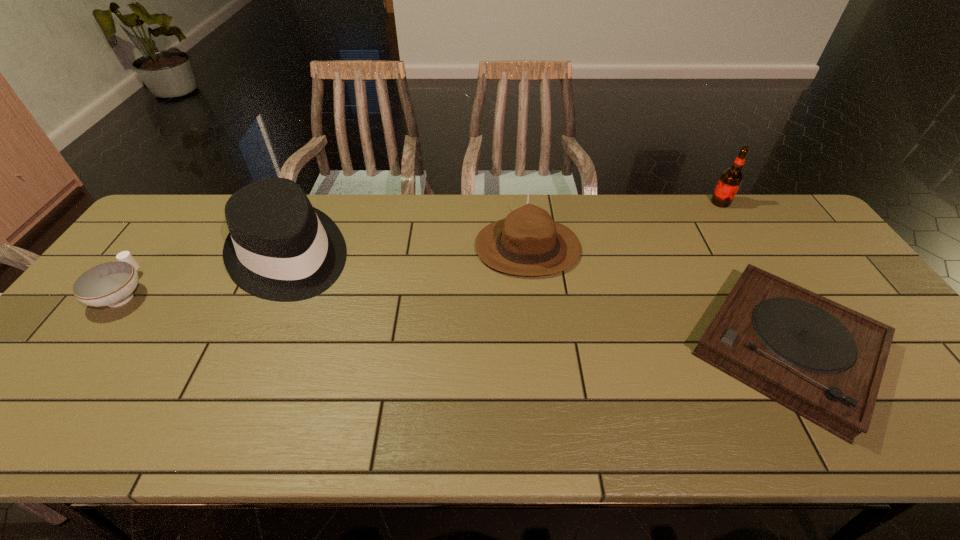
Where is `root beer`? root beer is located at coordinates (731, 179).

What are the coordinates of `the left fedora` in the screenshot? It's located at (280, 248).

Find the location of a particular element. This screenshot has width=960, height=540. the taller fedora is located at coordinates (280, 248).

Identify the location of the right fedora. This screenshot has height=540, width=960. (528, 242).

Identify the location of the third object from left to right. Image resolution: width=960 pixels, height=540 pixels. (528, 242).

Locate an element on the screen. This screenshot has height=540, width=960. the leftmost object is located at coordinates (111, 284).

Where is `phonograph record`? The image size is (960, 540). phonograph record is located at coordinates (824, 361).

Find the location of a particular element. Image resolution: width=960 pixels, height=540 pixels. free region located on the front of the farthest object is located at coordinates (753, 254).

This screenshot has height=540, width=960. Find the location of `free region located 0.240m on the front of the second object from left to right`. free region located 0.240m on the front of the second object from left to right is located at coordinates (233, 382).

You are a GUI agent. You are given a task and a screenshot of the screen. Output one action in this format:
    pyautogui.click(x=<x>, y=<y>)
    Task: Click on the free region located 0.190m on the feather side of the right fedora
    
    Given the screenshot: What is the action you would take?
    point(412,247)